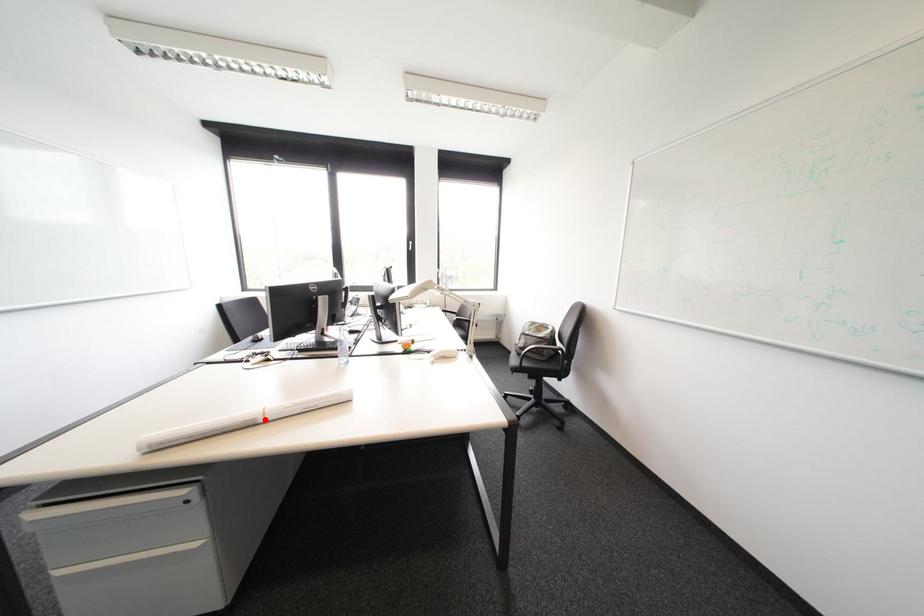
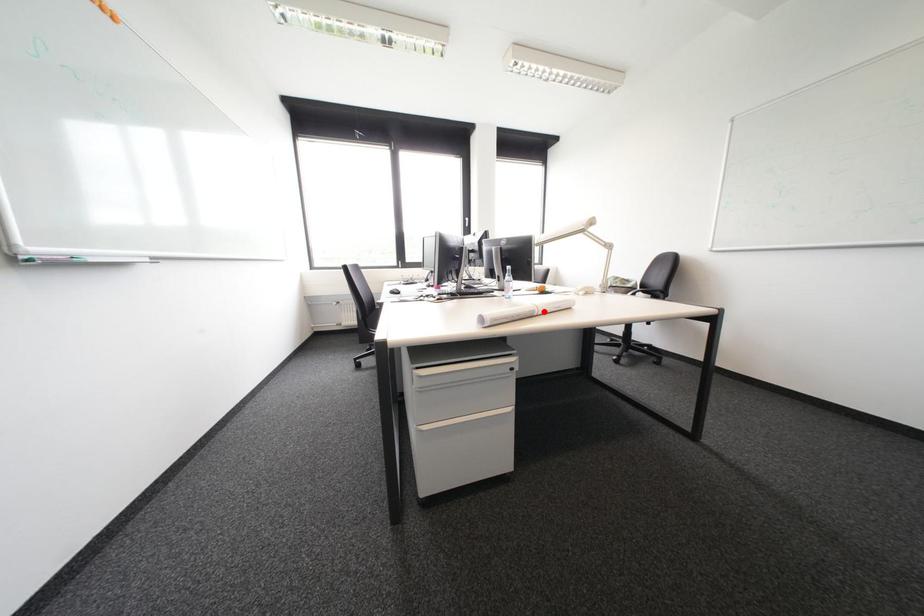
I am providing you with two images of the same scene from different viewpoints. A red point is marked on the first image and another point is marked on the second image. Is the red point in image1 aligned with the point shown in image2?

Yes